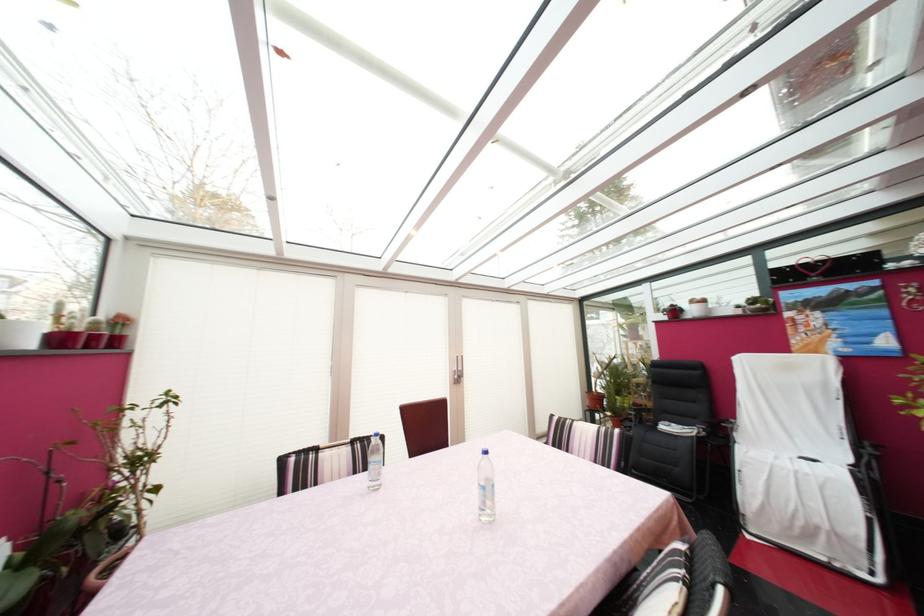
Where would you sit the black chair sitting surface? Please return your answer as a coordinate pair (x, y).

(667, 424)